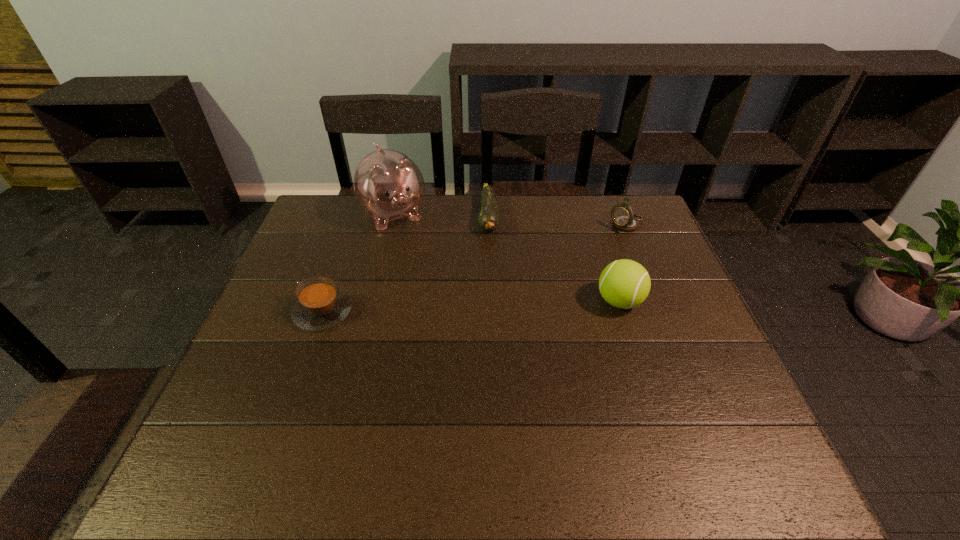
I want to click on free spot between the cappuccino and the piggy bank, so click(358, 263).

Identify the location of free space between the tallest object and the compass. The height and width of the screenshot is (540, 960). (510, 220).

I want to click on unoccupied position between the third object from right to left and the compass, so click(x=558, y=221).

Find the location of `free area in between the tallest object and the cappuccino`. free area in between the tallest object and the cappuccino is located at coordinates (358, 263).

Find the location of `free space between the tennis ball and the third object from left to right`. free space between the tennis ball and the third object from left to right is located at coordinates (554, 259).

Find the location of `free space between the piggy bank and the second shortest object`. free space between the piggy bank and the second shortest object is located at coordinates (358, 263).

Locate an element on the screen. The height and width of the screenshot is (540, 960). vacant space in between the piggy bank and the compass is located at coordinates (510, 220).

The height and width of the screenshot is (540, 960). Identify the location of empty location between the compass and the zucchini. (558, 221).

This screenshot has height=540, width=960. Find the location of `free space between the compass and the tallest object`. free space between the compass and the tallest object is located at coordinates (510, 220).

I want to click on object that is the second closest one to the piggy bank, so click(x=320, y=305).